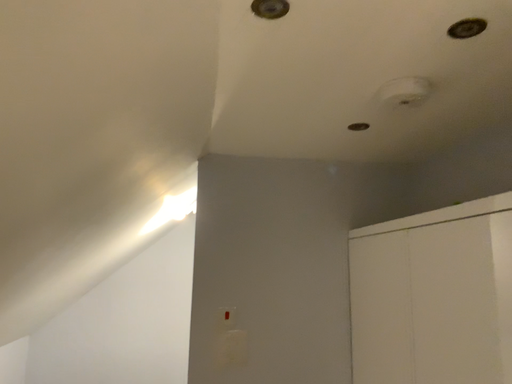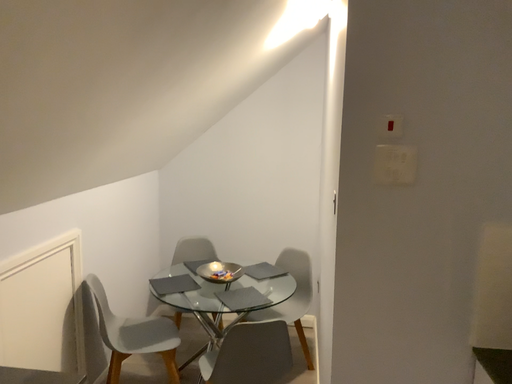
Question: Which way did the camera rotate in the video?

Choices:
 (A) rotated right
 (B) rotated left

Answer: (B)